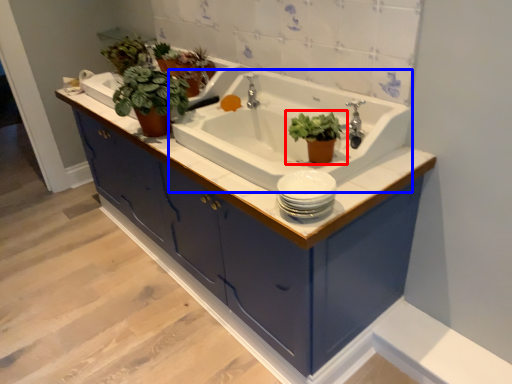
Question: Among these objects, which one is farthest to the camera, houseplant (highlighted by a red box) or sink (highlighted by a blue box)?

Choices:
 (A) houseplant
 (B) sink

Answer: (A)